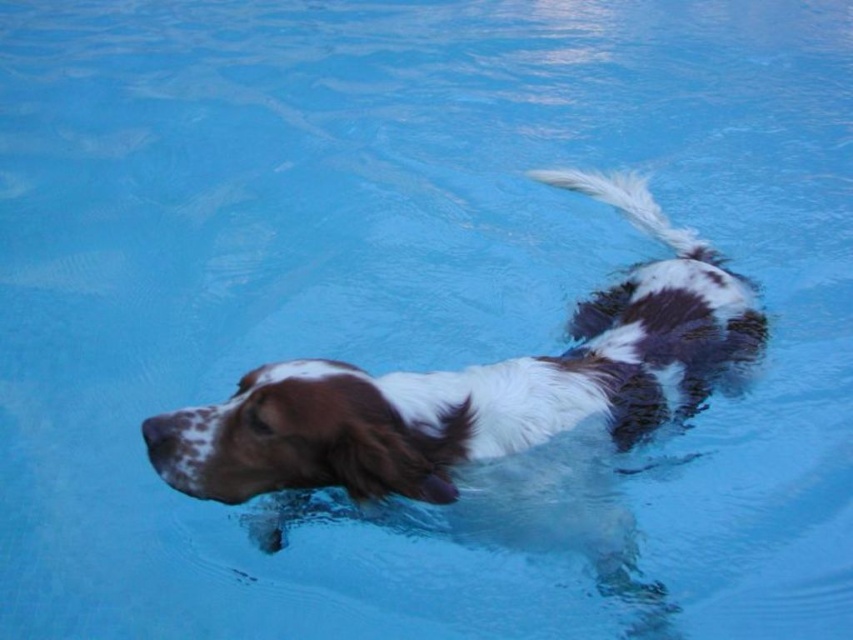
Question: Can you confirm if brown and white fur dog at center is positioned to the right of white fluffy tail at upper right?

Choices:
 (A) no
 (B) yes

Answer: (A)

Question: Which point is closer to the camera?

Choices:
 (A) (624, 205)
 (B) (648, 424)

Answer: (B)

Question: Which point is farther from the camera taking this photo?

Choices:
 (A) (610, 179)
 (B) (631, 346)

Answer: (A)

Question: Which of the following is the closest to the observer?

Choices:
 (A) 549,172
 (B) 532,364

Answer: (B)

Question: Can you confirm if brown and white fur dog at center is positioned to the right of white fluffy tail at upper right?

Choices:
 (A) no
 (B) yes

Answer: (A)

Question: Does brown and white fur dog at center appear over white fluffy tail at upper right?

Choices:
 (A) yes
 (B) no

Answer: (B)